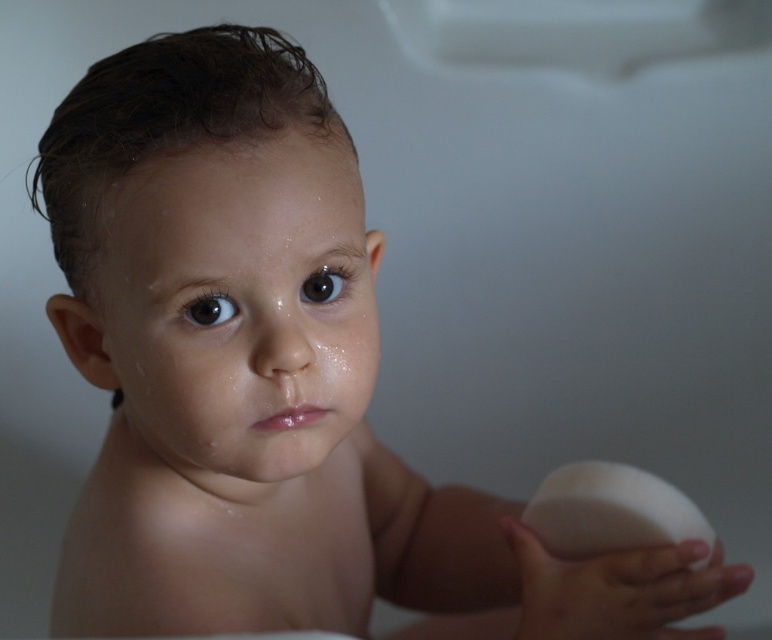
The child is holding two white items in their right hand. Which one is wider, the white matte ball at lower right or the white matte soap at lower right?

The white matte ball at lower right is wider than the white matte soap at lower right according to the description.

Consider the image. What is the exact position of the white matte ball at lower right in the image?

The white matte ball at lower right is located at point (618, 589).